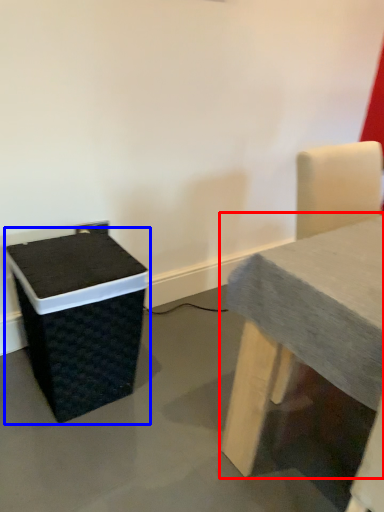
Question: Which object appears closest to the camera in this image, table (highlighted by a red box) or recycling bin (highlighted by a blue box)?

Choices:
 (A) table
 (B) recycling bin

Answer: (A)